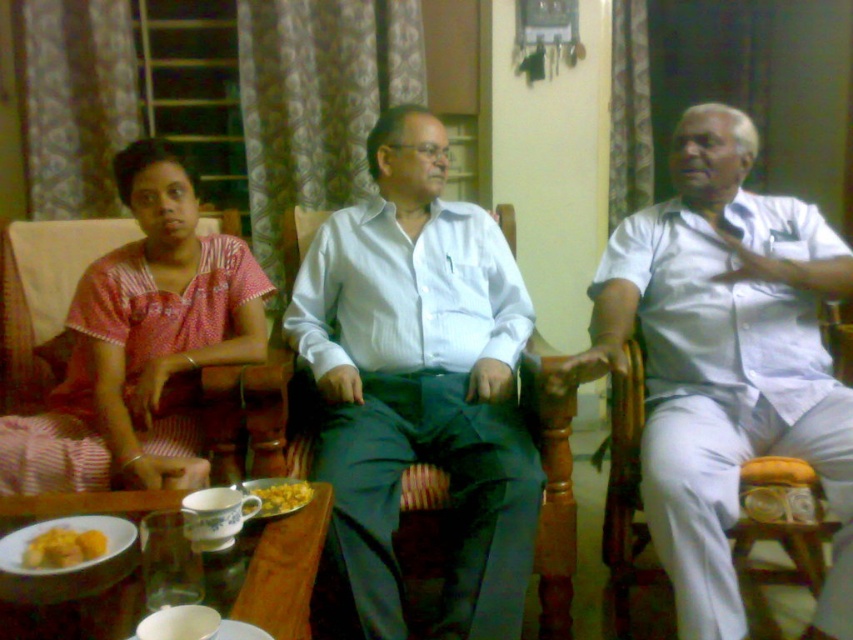
You are a photographer setting up a tripod in this living room. You need to ensure that the white cotton shirt at center and the yellow matte bread at lower left are both visible in the frame. Given their sizes, which object might require you to adjust your camera angle to include it properly?

The white cotton shirt at center is much taller than the yellow matte bread at lower left, so it might require adjusting the camera angle to ensure it fits within the frame.